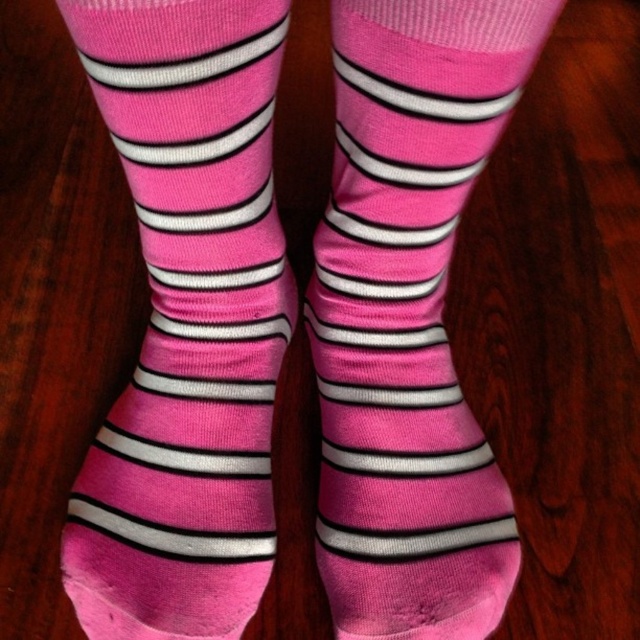
You are a photographer trying to capture the pink soft cotton sock at center. The camera you are using has a focal length of 50mm. If the socks are 29.17 inches apart, what is the minimum distance you need to stand from the socks to ensure both are fully in frame?

The minimum distance required is approximately 29.17 inches divided by the camera sensor width in inches. However, without knowing the sensor size, an exact distance can not be calculated. But since the socks are 29.17 inches apart, you need to position yourself far enough back so that both fit within the frame. A rough estimate would be around 3 to 5 feet away depending on the sensor size.